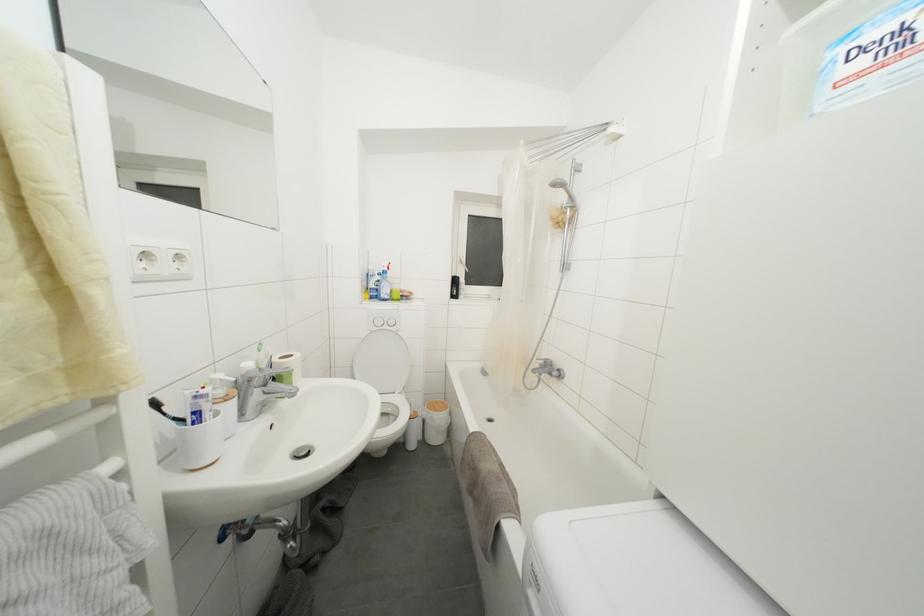
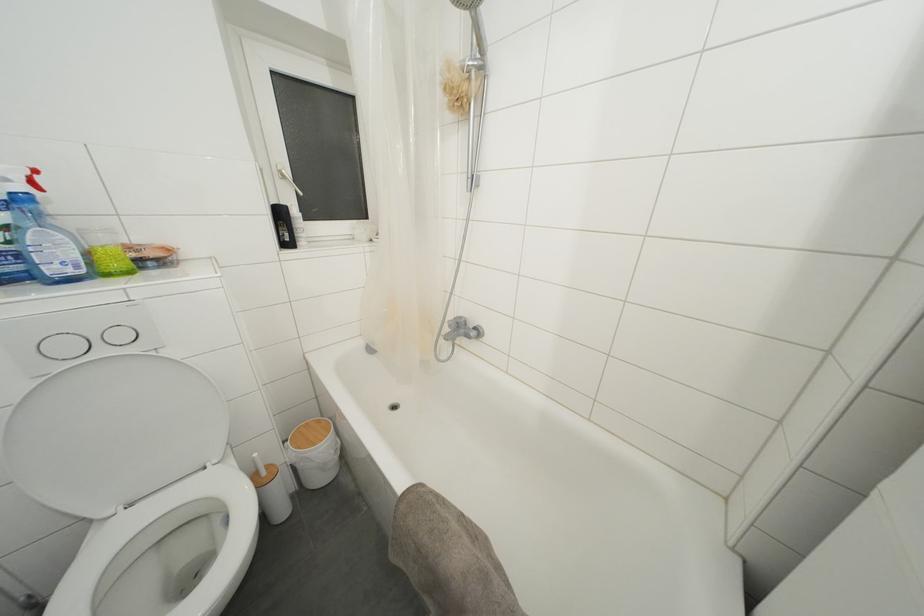
Locate, in the second image, the point that corresponds to the point at 390,331 in the first image.

(106, 357)